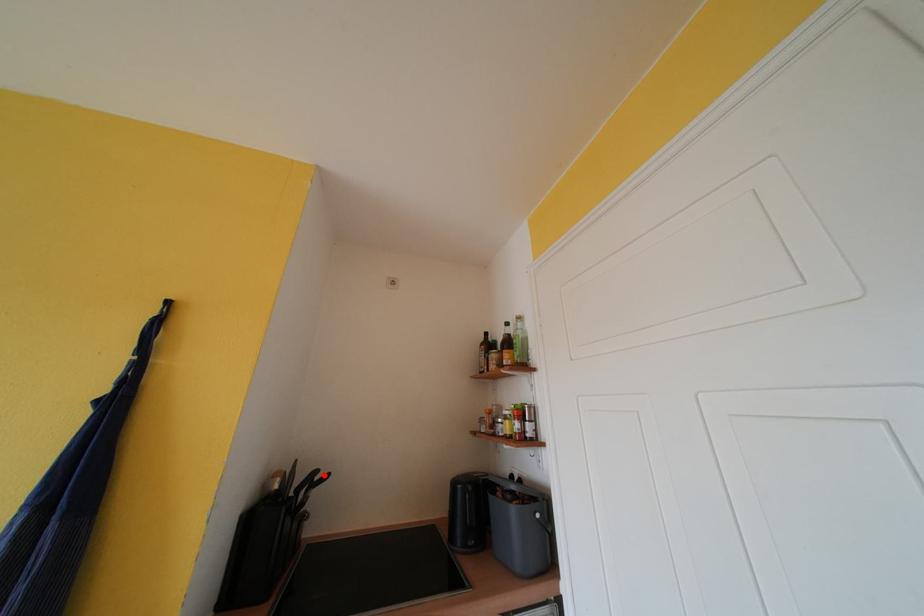
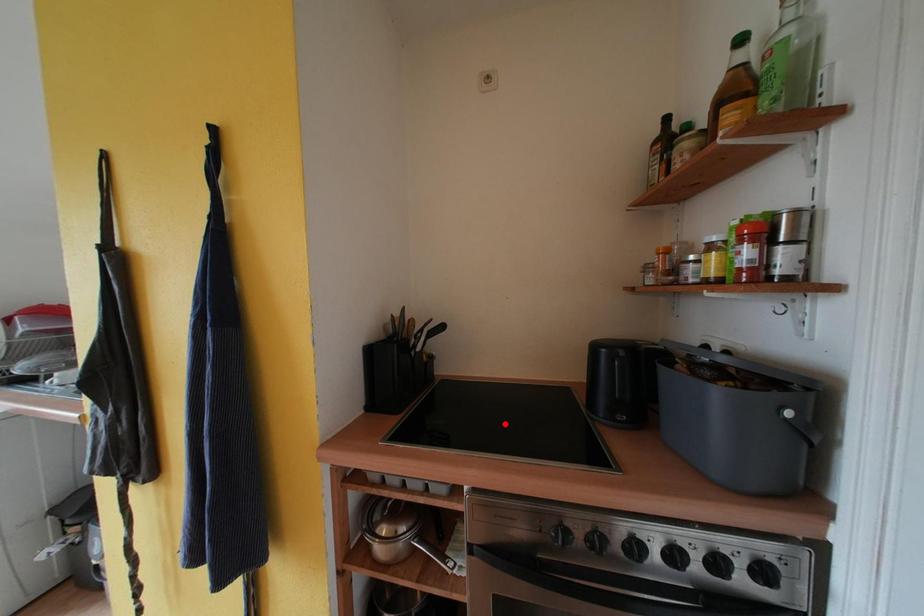
I am providing you with two images of the same scene from different viewpoints. A red point is marked on the first image and another point is marked on the second image. Is the marked point in image1 the same physical position as the marked point in image2?

No